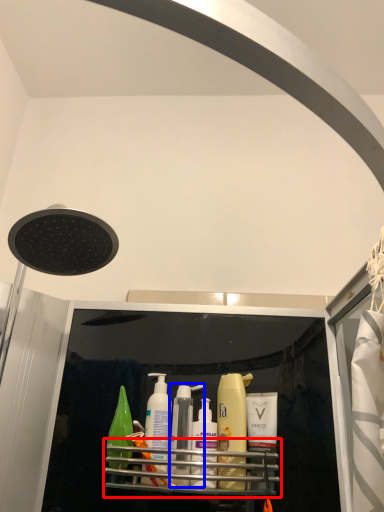
Question: Which object appears farthest to the camera in this image, shelf (highlighted by a red box) or toiletry (highlighted by a blue box)?

Choices:
 (A) shelf
 (B) toiletry

Answer: (B)